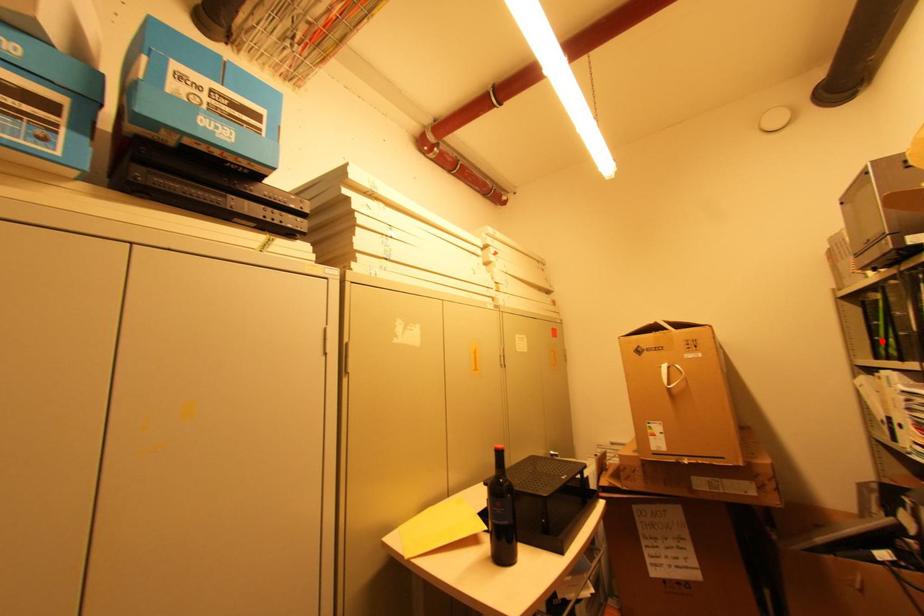
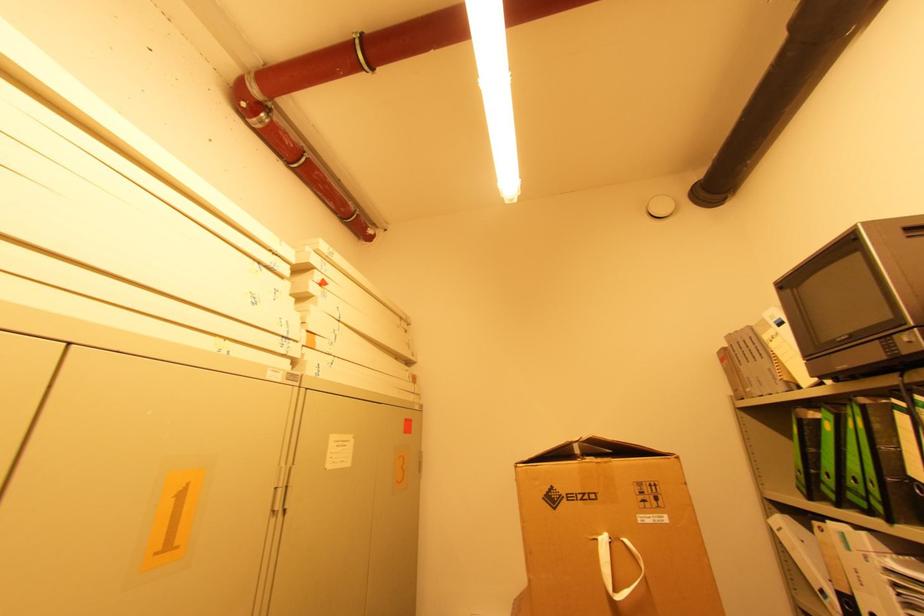
Locate, in the second image, the point that corresponds to the highlighted location in the first image.

(822, 476)